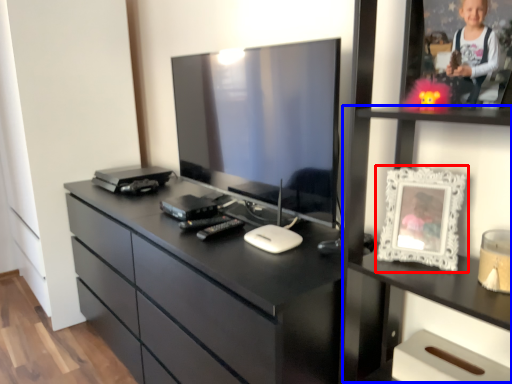
Question: Which object is closer to the camera taking this photo, picture frame (highlighted by a red box) or tv cabinet (highlighted by a blue box)?

Choices:
 (A) picture frame
 (B) tv cabinet

Answer: (B)